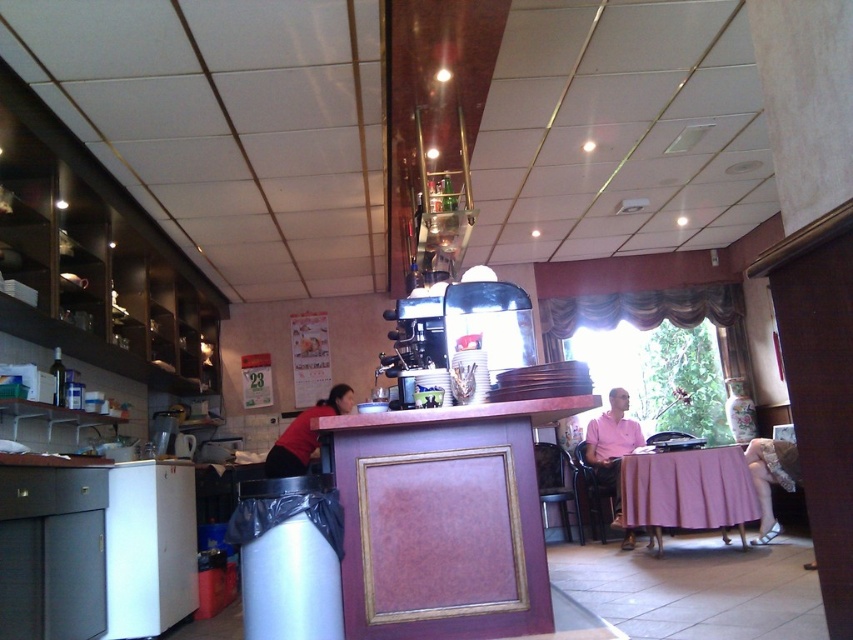
Question: Does pink fabric table at lower right appear on the left side of red shirt at counter?

Choices:
 (A) yes
 (B) no

Answer: (B)

Question: Which object is farther from the camera taking this photo?

Choices:
 (A) red shirt at counter
 (B) pink fabric table at lower right

Answer: (B)

Question: Can you confirm if pink fabric table at lower right is bigger than red shirt at counter?

Choices:
 (A) yes
 (B) no

Answer: (A)

Question: Which object is closer to the camera taking this photo?

Choices:
 (A) pink fabric table at lower right
 (B) red shirt at counter

Answer: (B)

Question: Does pink fabric table at lower right have a larger size compared to red shirt at counter?

Choices:
 (A) yes
 (B) no

Answer: (A)